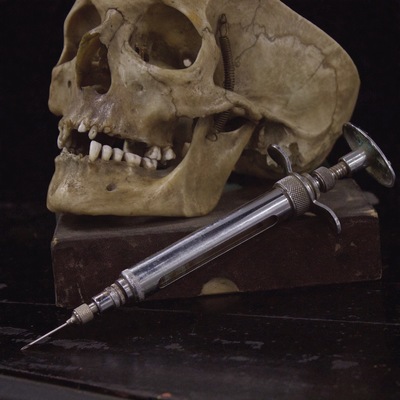
I want to click on book, so click(x=309, y=270).